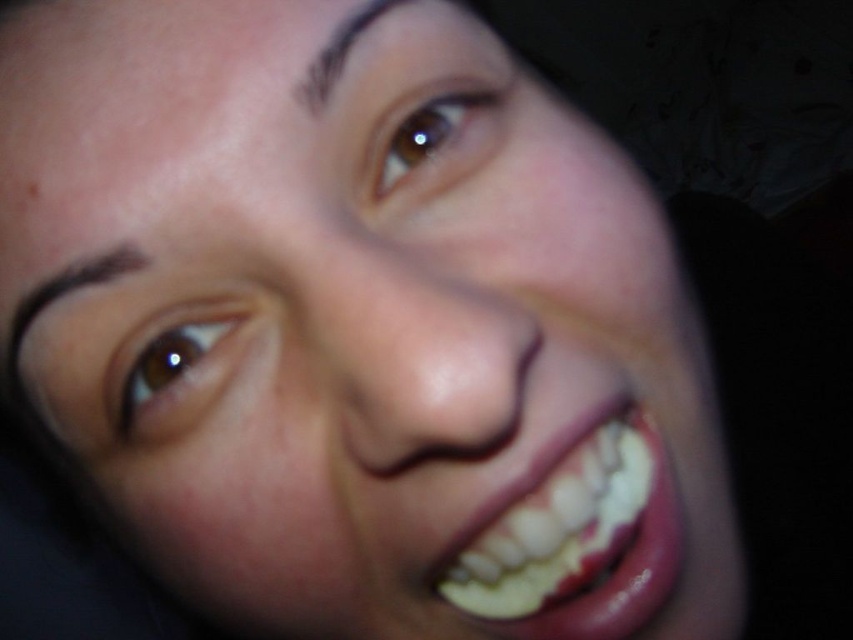
Between brown matte eye at upper left and brown shiny eye at upper center, which one is positioned lower?

Positioned lower is brown matte eye at upper left.

Does brown matte eye at upper left have a smaller size compared to brown shiny eye at upper center?

Yes.

Which is in front, point (199, 307) or point (425, 163)?

Positioned in front is point (199, 307).

Identify the location of brown matte eye at upper left. This screenshot has width=853, height=640. (171, 355).

Is shiny white teeth at lower right closer to camera compared to brown matte eyebrow at upper left?

Yes, shiny white teeth at lower right is closer to the viewer.

Describe the element at coordinates (578, 547) in the screenshot. I see `shiny white teeth at lower right` at that location.

Where is `shiny white teeth at lower right`? shiny white teeth at lower right is located at coordinates (578, 547).

Which is in front, point (461, 115) or point (378, 16)?

Point (378, 16) is more forward.

Based on the photo, between brown shiny eye at upper center and brown matte eyebrow at upper center, which one is positioned higher?

brown matte eyebrow at upper center

Find the location of a particular element. brown shiny eye at upper center is located at coordinates (432, 134).